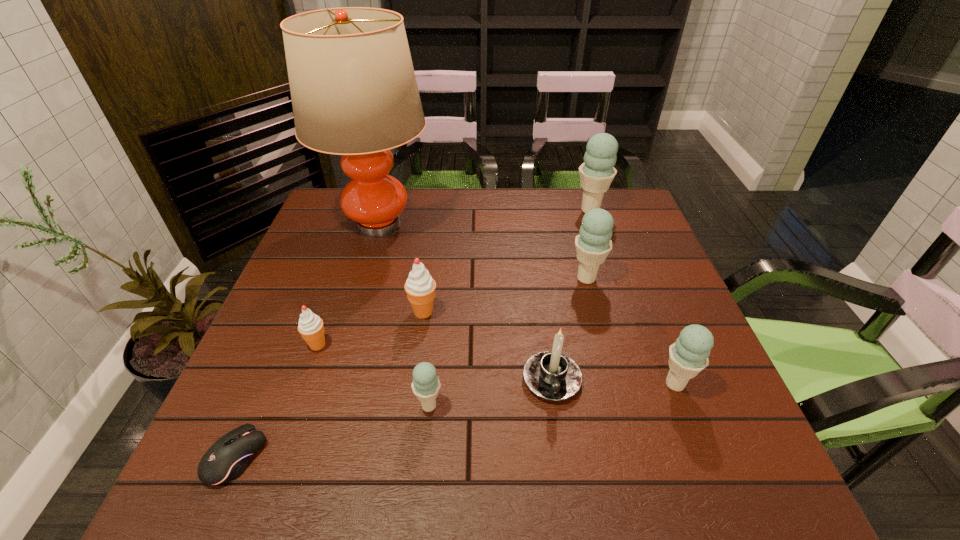
Locate an element on the screen. The width and height of the screenshot is (960, 540). the fourth farthest ice cream is located at coordinates (311, 328).

You are a GUI agent. You are given a task and a screenshot of the screen. Output one action in this format:
    pyautogui.click(x=<x>, y=<y>)
    Task: Click on the smaller red icecream
    
    Given the screenshot: What is the action you would take?
    pyautogui.click(x=311, y=328)

I want to click on the leftmost blue ice cream, so click(426, 384).

Where is `the nearest object`? the nearest object is located at coordinates (229, 456).

Where is `black computer mouse`? The width and height of the screenshot is (960, 540). black computer mouse is located at coordinates (229, 456).

The image size is (960, 540). Find the location of `vacant space located 0.160m on the right of the tallest object`. vacant space located 0.160m on the right of the tallest object is located at coordinates (487, 224).

This screenshot has width=960, height=540. I want to click on blank space located on the left of the tallest ice cream, so pos(481,210).

Find the location of a particular element. vacant region located 0.390m on the left of the third smallest blue ice cream is located at coordinates point(420,278).

Find the location of `vacant point located 0.200m on the front of the bigger red icecream`. vacant point located 0.200m on the front of the bigger red icecream is located at coordinates (413, 395).

Locate an element on the screen. The image size is (960, 540). vacant space located on the back of the second smallest blue ice cream is located at coordinates (638, 289).